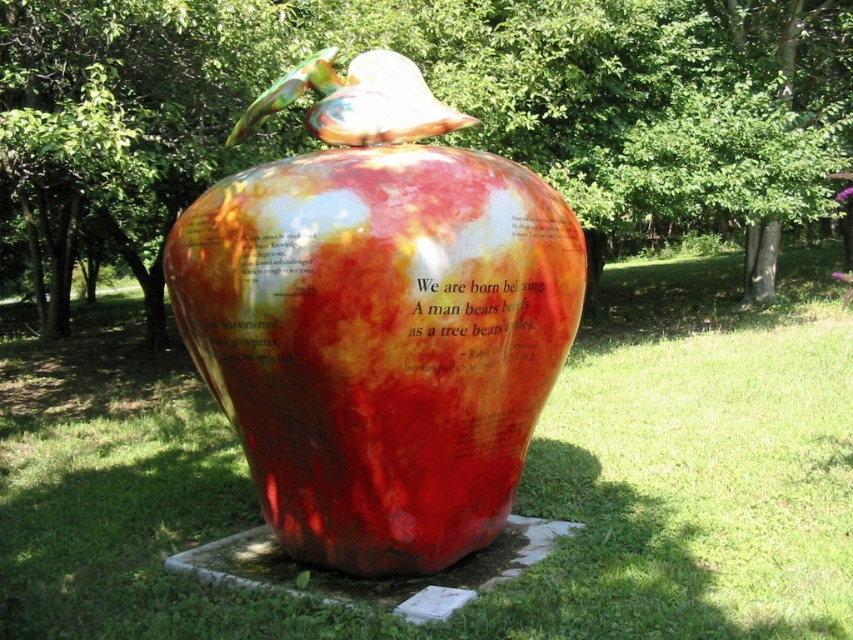
Which is in front, point (91, 364) or point (419, 216)?

Positioned in front is point (419, 216).

Is green grass at center taller than shiny ceramic vase at center?

No.

Is point (119, 586) closer to viewer compared to point (492, 344)?

That is False.

Identify the location of green grass at center. The image size is (853, 640). (519, 486).

Who is shorter, glossy ceramic apple at center or shiny ceramic vase at center?

Standing shorter between the two is shiny ceramic vase at center.

What do you see at coordinates (433, 88) in the screenshot? This screenshot has width=853, height=640. I see `glossy ceramic apple at center` at bounding box center [433, 88].

I want to click on glossy ceramic apple at center, so click(433, 88).

Does green grass at center come in front of glossy ceramic apple at center?

Yes, green grass at center is closer to the viewer.

Can you confirm if green grass at center is taller than glossy ceramic apple at center?

No, green grass at center is not taller than glossy ceramic apple at center.

Locate an element on the screen. The width and height of the screenshot is (853, 640). green grass at center is located at coordinates (519, 486).